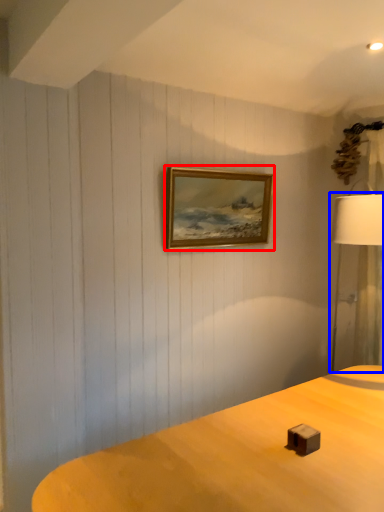
Question: Which point is closer to the camera, picture frame (highlighted by a red box) or lamp (highlighted by a blue box)?

Choices:
 (A) picture frame
 (B) lamp

Answer: (B)